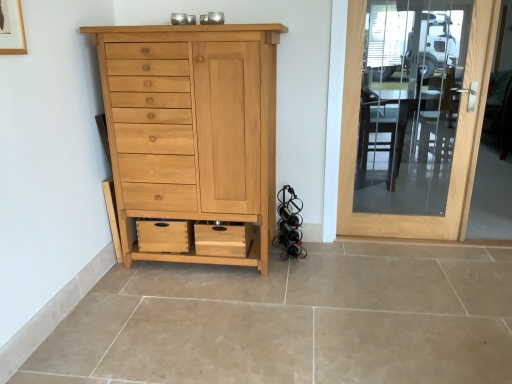
Question: From a real-world perspective, is clear glass door at right under natural wood cabinet at center?

Choices:
 (A) yes
 (B) no

Answer: (B)

Question: From the image's perspective, would you say clear glass door at right is shown under natural wood cabinet at center?

Choices:
 (A) no
 (B) yes

Answer: (A)

Question: Can you confirm if clear glass door at right is thinner than natural wood cabinet at center?

Choices:
 (A) yes
 (B) no

Answer: (A)

Question: Is clear glass door at right smaller than natural wood cabinet at center?

Choices:
 (A) yes
 (B) no

Answer: (A)

Question: Is clear glass door at right wider than natural wood cabinet at center?

Choices:
 (A) yes
 (B) no

Answer: (B)

Question: From the image's perspective, is clear glass door at right on natural wood cabinet at center?

Choices:
 (A) no
 (B) yes

Answer: (B)

Question: Can you confirm if natural wood cabinet at center is shorter than clear glass door at right?

Choices:
 (A) yes
 (B) no

Answer: (A)

Question: Can you confirm if natural wood cabinet at center is positioned to the right of clear glass door at right?

Choices:
 (A) no
 (B) yes

Answer: (A)

Question: Does natural wood cabinet at center come in front of clear glass door at right?

Choices:
 (A) yes
 (B) no

Answer: (A)

Question: Can you confirm if natural wood cabinet at center is positioned to the left of clear glass door at right?

Choices:
 (A) yes
 (B) no

Answer: (A)

Question: Is natural wood cabinet at center wider than clear glass door at right?

Choices:
 (A) yes
 (B) no

Answer: (A)

Question: From the image's perspective, is natural wood cabinet at center beneath clear glass door at right?

Choices:
 (A) no
 (B) yes

Answer: (B)

Question: In the image, is clear glass door at right on the left side or the right side of natural wood cabinet at center?

Choices:
 (A) left
 (B) right

Answer: (B)